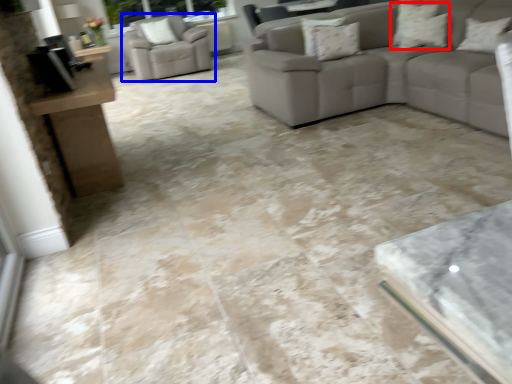
Question: Which object appears farthest to the camera in this image, pillow (highlighted by a red box) or chair (highlighted by a blue box)?

Choices:
 (A) pillow
 (B) chair

Answer: (B)